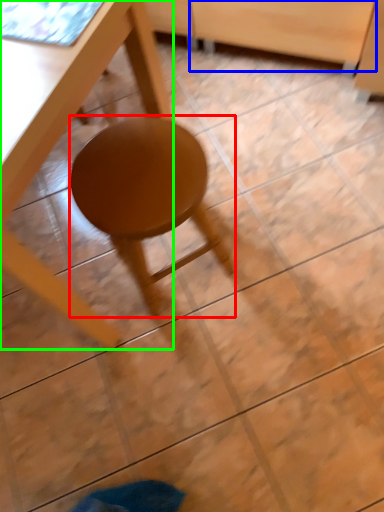
Question: Which is farther away from stool (highlighted by a red box)? drawer (highlighted by a blue box) or table (highlighted by a green box)?

Choices:
 (A) drawer
 (B) table

Answer: (A)